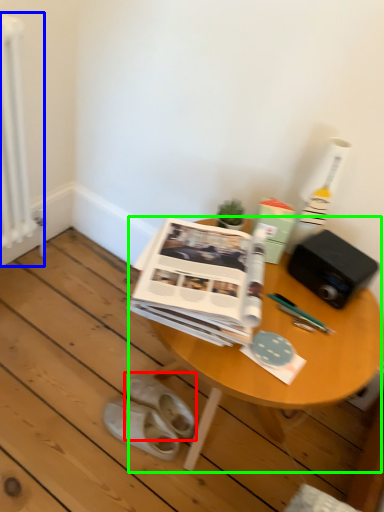
Question: Estimate the real-world distances between objects in this image. Which object is farther from footwear (highlighted by a red box), radiator (highlighted by a blue box) or table (highlighted by a green box)?

Choices:
 (A) radiator
 (B) table

Answer: (A)